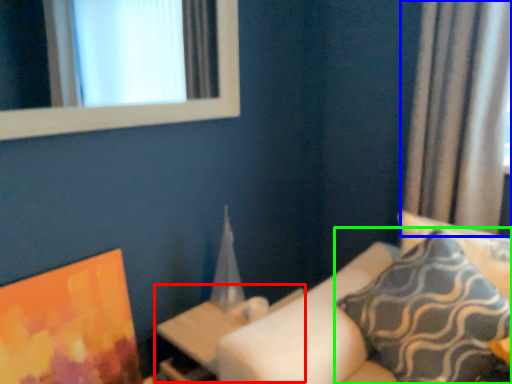
Question: Which object is positioned closest to table (highlighted by a red box)? Select from curtain (highlighted by a blue box) and pillow (highlighted by a green box).

Choices:
 (A) curtain
 (B) pillow

Answer: (B)